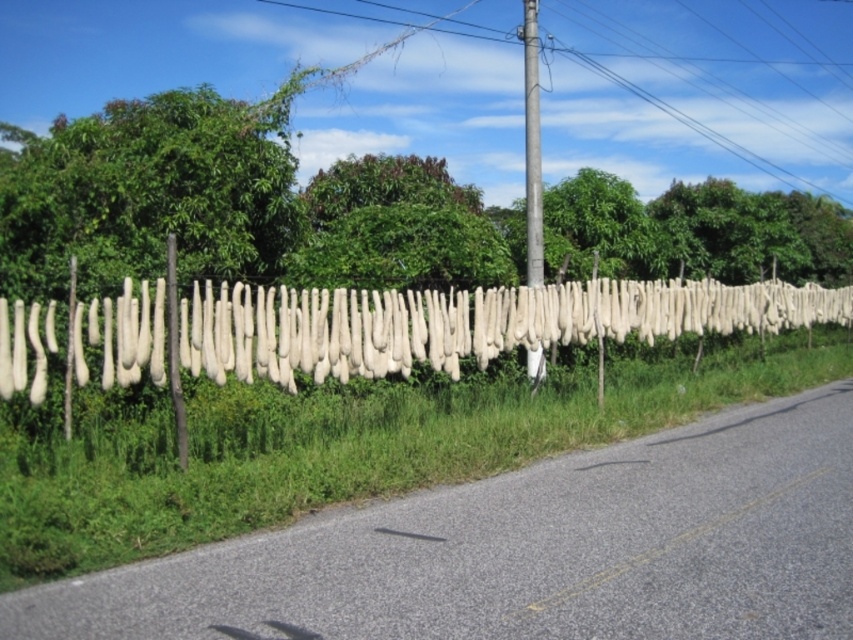
Does point (538, 156) lie behind point (532, 605)?

That is True.

Which is behind, point (538, 125) or point (801, 481)?

The point (538, 125) is behind.

Measure the distance between metallic gray pole at center and camera.

The distance of metallic gray pole at center from camera is 12.70 meters.

Find the location of a particular element. This screenshot has width=853, height=640. metallic gray pole at center is located at coordinates (532, 145).

Locate an element on the screen. Image resolution: width=853 pixels, height=640 pixels. white fabric at center is located at coordinates (413, 324).

Between white fabric at center and yellow asphalt road at center, which one is positioned higher?

Positioned higher is white fabric at center.

Between point (277, 310) and point (804, 474), which one is positioned behind?

Positioned behind is point (277, 310).

Find the location of `white fabric at center`. white fabric at center is located at coordinates (413, 324).

Who is positioned more to the left, white fabric at center or metallic gray pole at center?

Positioned to the left is white fabric at center.

Based on the photo, who is higher up, white fabric at center or metallic gray pole at center?

Positioned higher is metallic gray pole at center.

Identify the location of white fabric at center. Image resolution: width=853 pixels, height=640 pixels. (413, 324).

Locate an element on the screen. The height and width of the screenshot is (640, 853). white fabric at center is located at coordinates pos(413,324).